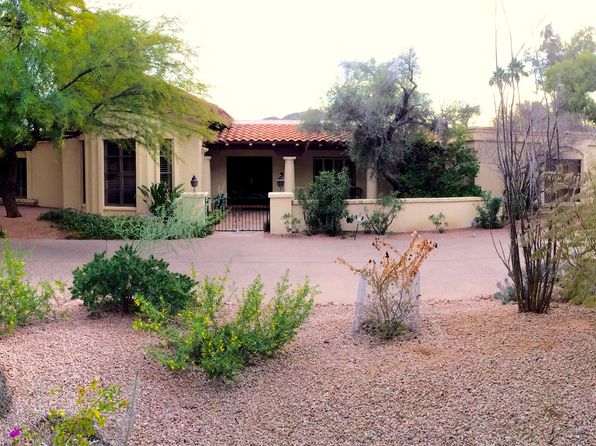
Locate an element on the screen. This screenshot has width=596, height=446. brown plant in the foreground is located at coordinates (406, 252).